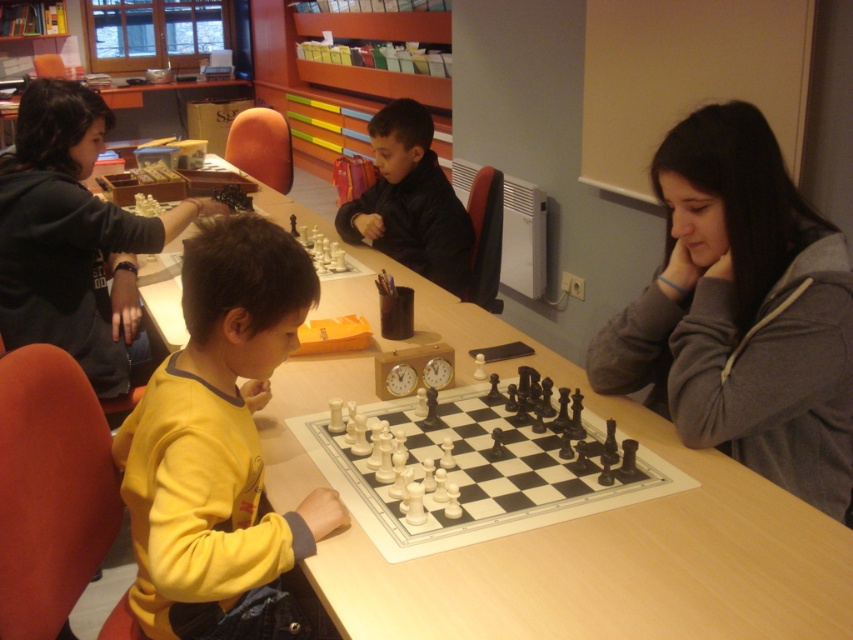
You are organizing a chess tournament and need to store the gray fleece hoodie at center and the black plastic chess set at center in a single drawer. If the drawer can only accommodate items smaller than the chess set, will both items fit?

The gray fleece hoodie at center is bigger than the black plastic chess set at center. Since the drawer can only hold items smaller than the chess set, the hoodie won

You are sitting at the table and want to reach for the cup near the chess clock. The yellow fleece at center and dark gray hoodie at left are on the table. Which item is closer to you?

The yellow fleece at center is closer to you because it is in front of the dark gray hoodie at left.

You are organizing a chess tournament and need to place a new chessboard between the yellow fleece at center and the dark gray hoodie at left. Based on their sizes, which object should the chessboard be closer to?

The chessboard should be closer to the dark gray hoodie at left because the yellow fleece at center occupies less space than the dark gray hoodie at left, meaning the hoodie takes up more area and the chessboard can be placed nearer to it without overlapping.